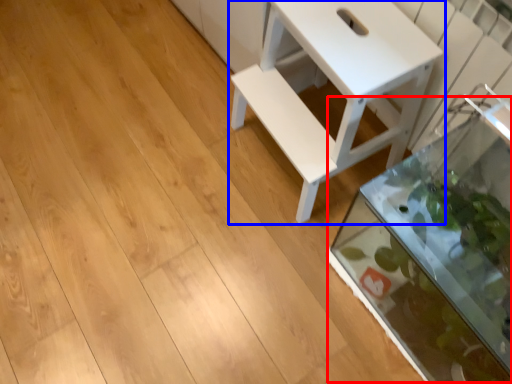
Question: Among these objects, which one is farthest to the camera, glass box (highlighted by a red box) or table (highlighted by a blue box)?

Choices:
 (A) glass box
 (B) table

Answer: (B)